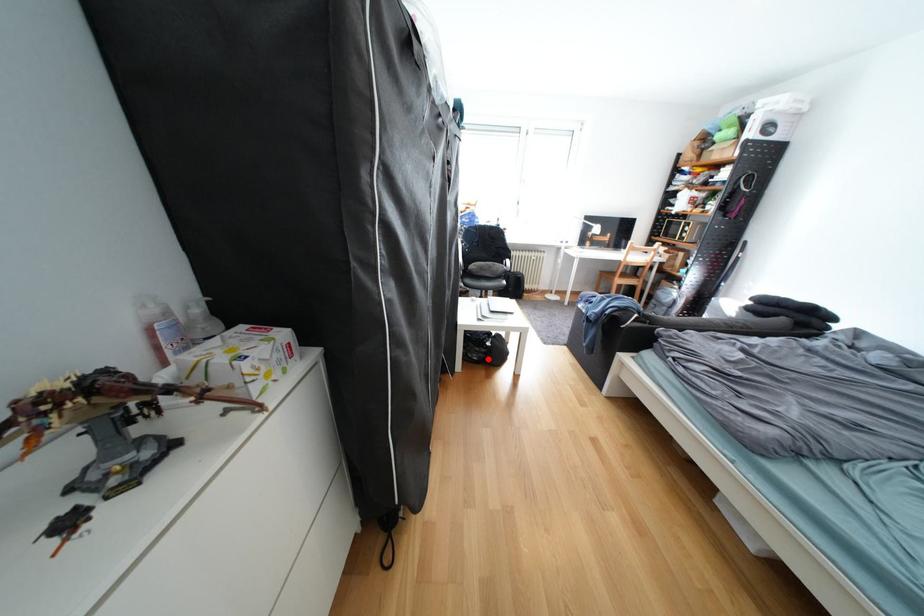
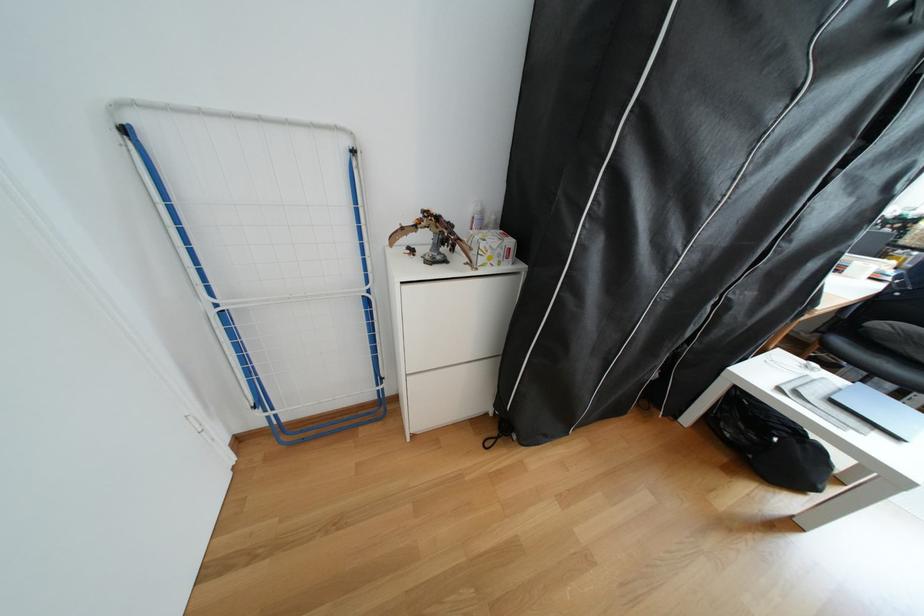
In the second image, find the point that corresponds to the highlighted location in the first image.

(739, 436)